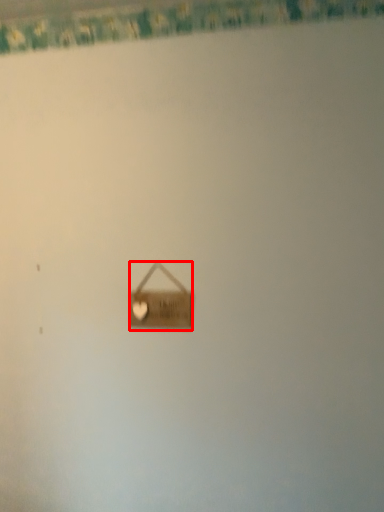
Question: Where is handbag (annotated by the red box) located in relation to curtain in the image?

Choices:
 (A) right
 (B) left

Answer: (B)